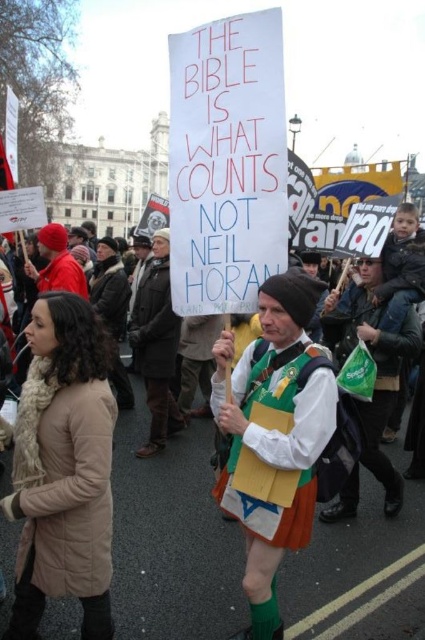
Does point (401, 605) lie in front of point (334, 342)?

Yes, it is in front of point (334, 342).

Is white paper sign at center smaller than green fabric scarf at center?

No.

You are a GUI agent. You are given a task and a screenshot of the screen. Output one action in this format:
    pyautogui.click(x=<x>, y=<y>)
    Task: Click on the white paper sign at center
    Image resolution: width=425 pixels, height=640 pixels.
    Given the screenshot: What is the action you would take?
    pyautogui.click(x=172, y=538)

From the picture: Which is above, white paper sign at center or brown leather jacket at center?

Positioned higher is brown leather jacket at center.

Which is behind, point (388, 604) or point (133, 310)?

Positioned behind is point (133, 310).

This screenshot has height=640, width=425. Identify the location of white paper sign at center. (172, 538).

Does green fabric scarf at center have a lesser width compared to brown leather jacket at center?

No, green fabric scarf at center is not thinner than brown leather jacket at center.

Who is higher up, green fabric scarf at center or brown leather jacket at center?

brown leather jacket at center

Where is `green fabric scarf at center`? green fabric scarf at center is located at coordinates (374, 384).

This screenshot has height=640, width=425. What are the coordinates of `green fabric scarf at center` in the screenshot? It's located at (374, 384).